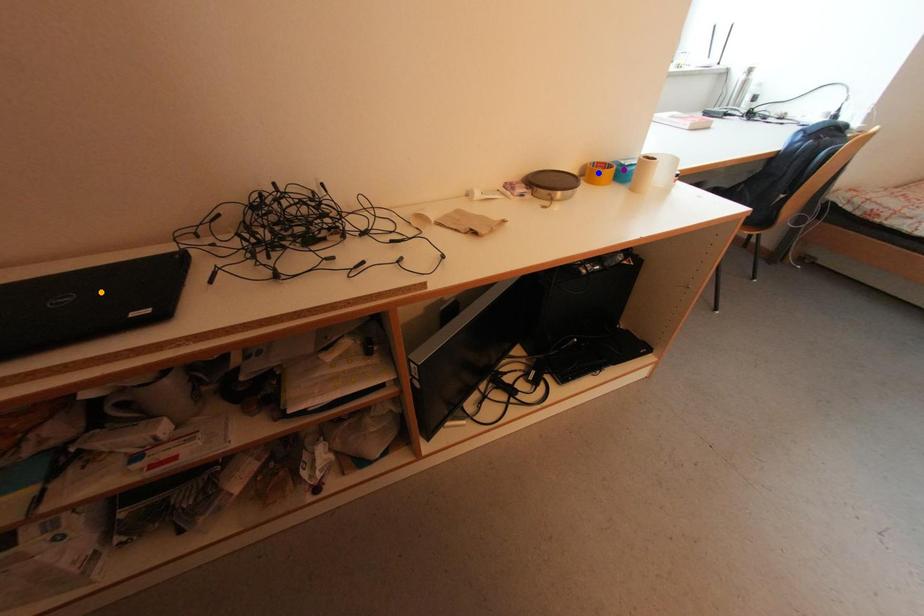
Order these from nearest to farthest:
- orange point
- purple point
- blue point

orange point, blue point, purple point